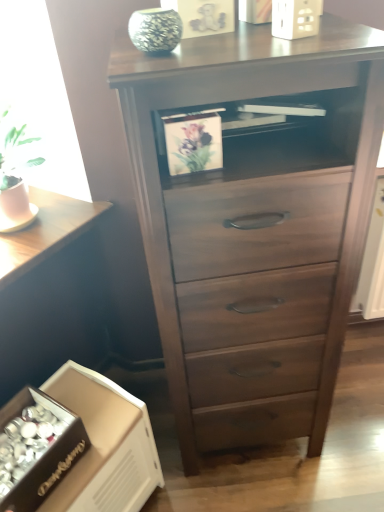
Question: Considering the relative positions of white cardboard box at lower left and dark wood table at lower left in the image provided, is white cardboard box at lower left in front of dark wood table at lower left?

Choices:
 (A) yes
 (B) no

Answer: (A)

Question: Is white cardboard box at lower left bigger than dark wood table at lower left?

Choices:
 (A) yes
 (B) no

Answer: (B)

Question: From a real-world perspective, does white cardboard box at lower left sit lower than dark wood table at lower left?

Choices:
 (A) yes
 (B) no

Answer: (A)

Question: Considering the relative sizes of white cardboard box at lower left and dark wood table at lower left in the image provided, is white cardboard box at lower left smaller than dark wood table at lower left?

Choices:
 (A) no
 (B) yes

Answer: (B)

Question: Does white cardboard box at lower left have a lesser height compared to dark wood table at lower left?

Choices:
 (A) no
 (B) yes

Answer: (B)

Question: From the image's perspective, does white cardboard box at lower left appear lower than dark wood table at lower left?

Choices:
 (A) yes
 (B) no

Answer: (A)

Question: Is white cardboard box at lower left placed right next to green textured vase at upper center?

Choices:
 (A) no
 (B) yes

Answer: (A)

Question: Is white cardboard box at lower left oriented towards green textured vase at upper center?

Choices:
 (A) yes
 (B) no

Answer: (B)

Question: Is the position of white cardboard box at lower left less distant than that of green textured vase at upper center?

Choices:
 (A) yes
 (B) no

Answer: (B)

Question: Does white cardboard box at lower left have a larger size compared to green textured vase at upper center?

Choices:
 (A) no
 (B) yes

Answer: (B)

Question: Is white cardboard box at lower left turned away from green textured vase at upper center?

Choices:
 (A) yes
 (B) no

Answer: (B)

Question: From a real-world perspective, is white cardboard box at lower left below green textured vase at upper center?

Choices:
 (A) yes
 (B) no

Answer: (A)

Question: From the image's perspective, does dark wood chest of drawers at center appear higher than dark wood table at lower left?

Choices:
 (A) yes
 (B) no

Answer: (A)